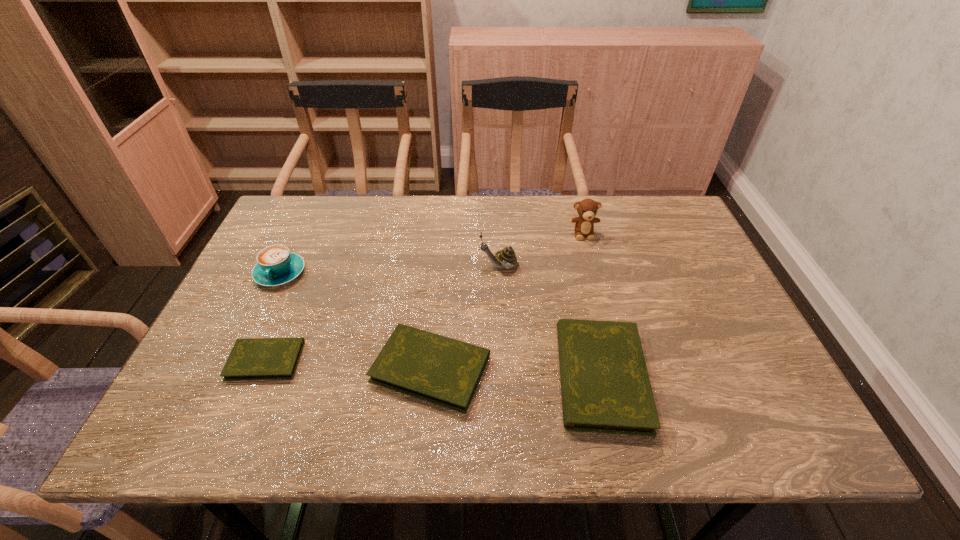
Locate an element on the screen. Image resolution: width=960 pixels, height=540 pixels. vacant space located on the back of the rightmost diary is located at coordinates (575, 263).

I want to click on vacant space positioned with the handle on the right side of the cappuccino, so click(255, 327).

Identify the location of vacant area situated 0.140m on the face of the farthest object. The width and height of the screenshot is (960, 540). (594, 274).

Identify the location of vacant region located 0.140m on the face of the snail. (427, 266).

At what (x,y) coordinates should I click in order to perform the action: click on vacant space located 0.230m on the face of the snail. Please return your answer as a coordinate pair (x, y). The width and height of the screenshot is (960, 540). Looking at the image, I should click on (395, 266).

Find the location of `free space located 0.220m on the face of the snail`. free space located 0.220m on the face of the snail is located at coordinates (398, 266).

Where is `object that is at the far edge`? The width and height of the screenshot is (960, 540). object that is at the far edge is located at coordinates (584, 224).

The height and width of the screenshot is (540, 960). Find the location of `diary at the left edge`. diary at the left edge is located at coordinates (258, 358).

Where is `cappuccino at the left edge`? The width and height of the screenshot is (960, 540). cappuccino at the left edge is located at coordinates (276, 265).

You are a GUI agent. You are given a task and a screenshot of the screen. Output one action in this format:
    pyautogui.click(x=<x>, y=<y>)
    Task: Click on the object positioned at the near left corner
    Image resolution: width=960 pixels, height=540 pixels.
    Given the screenshot: What is the action you would take?
    pyautogui.click(x=258, y=358)